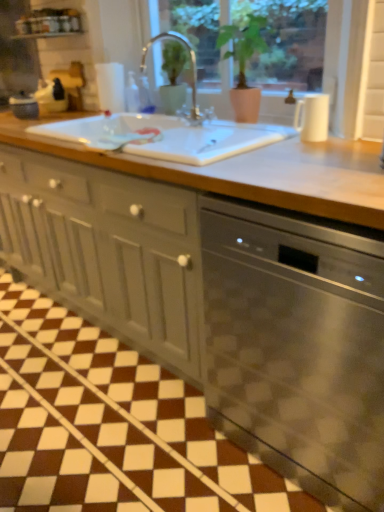
Where is `free spot above stainless steel dishwasher at center (from a real-world perspective)`? The width and height of the screenshot is (384, 512). free spot above stainless steel dishwasher at center (from a real-world perspective) is located at coordinates (321, 159).